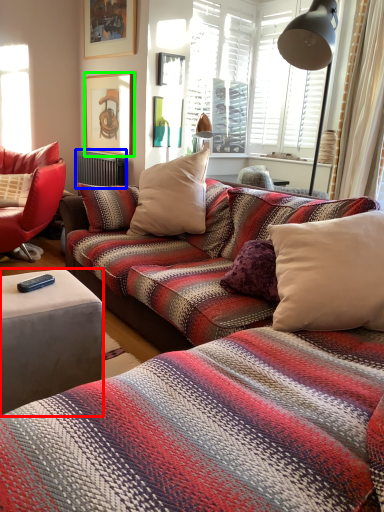
Question: Based on their relative distances, which object is nearer to studio couch (highlighted by a red box)? Choose from radiator (highlighted by a blue box) and picture frame (highlighted by a green box).

Choices:
 (A) radiator
 (B) picture frame

Answer: (A)